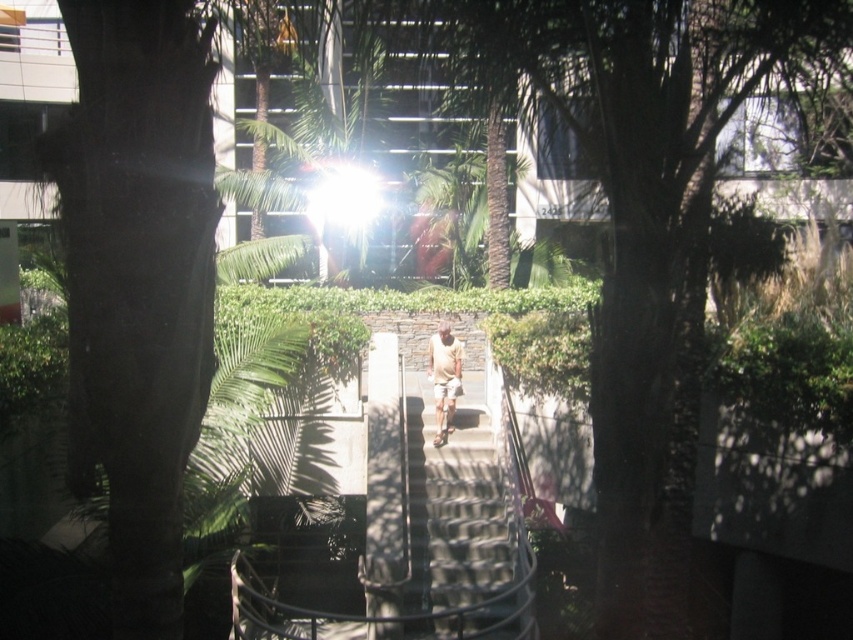
You are standing in front of the window and see two points marked on the glass. The first point is at coordinates point (485, 420) and the second is at point (450, 372). Which point is closer to you?

Point (450, 372) is closer to you because it is closer to the camera than point (485, 420).

You are a photographer trying to capture the smooth concrete stairs at center and the light brown shorts at center in a single shot. Based on their heights, which object should you focus on first to ensure both are in frame?

The smooth concrete stairs at center is much taller than the light brown shorts at center, so you should focus on the smooth concrete stairs at center first to ensure both are in frame.